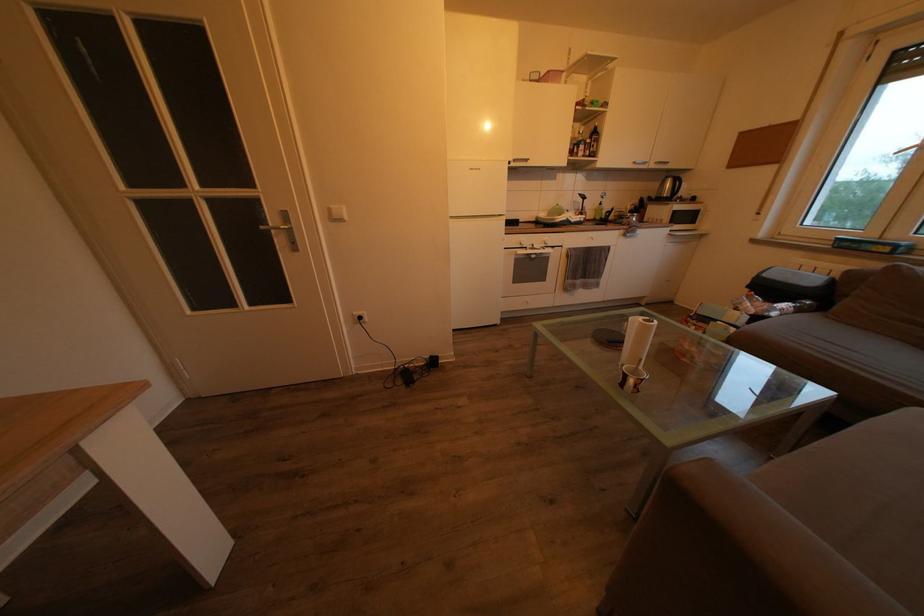
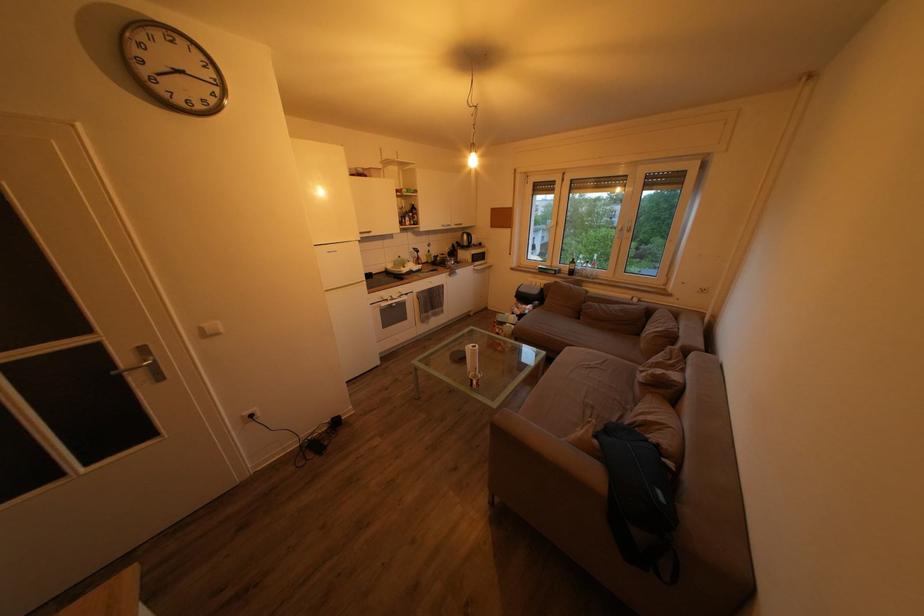
Question: The first image is from the beginning of the video and the second image is from the end. How did the camera likely rotate when shooting the video?

Choices:
 (A) Left
 (B) Right
 (C) Up
 (D) Down

Answer: (B)